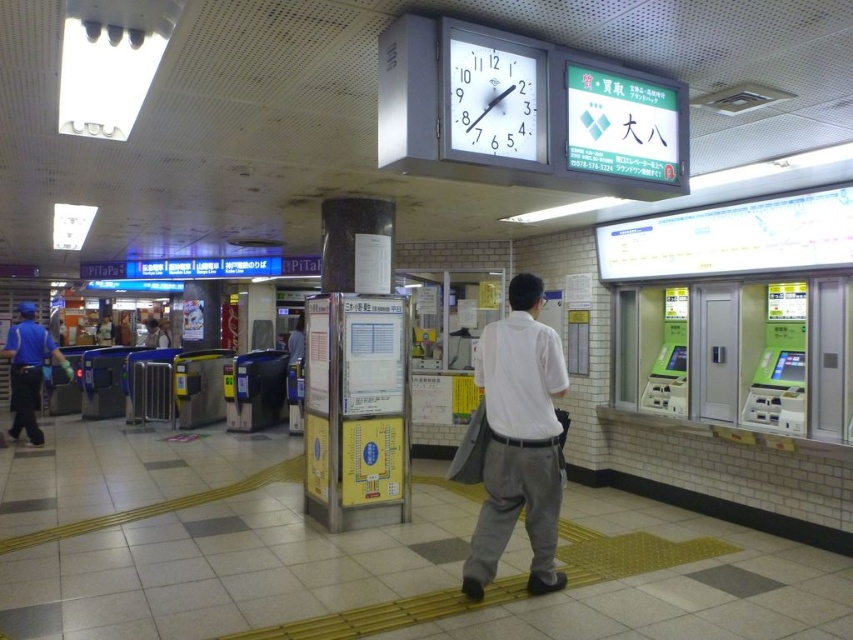
Question: Which object is closer to the camera taking this photo?

Choices:
 (A) white cotton shirt at center
 (B) blue uniform at left

Answer: (A)

Question: Does white cotton shirt at center have a lesser width compared to white glossy clock at upper center?

Choices:
 (A) no
 (B) yes

Answer: (A)

Question: Is white cotton shirt at center wider than blue uniform at left?

Choices:
 (A) no
 (B) yes

Answer: (A)

Question: Which point is closer to the camera?

Choices:
 (A) (537, 394)
 (B) (16, 346)
 (C) (508, 100)

Answer: (C)

Question: Does white cotton shirt at center have a larger size compared to blue uniform at left?

Choices:
 (A) no
 (B) yes

Answer: (A)

Question: Which point is farther to the camera?

Choices:
 (A) white cotton shirt at center
 (B) white glossy clock at upper center
 (C) blue uniform at left

Answer: (C)